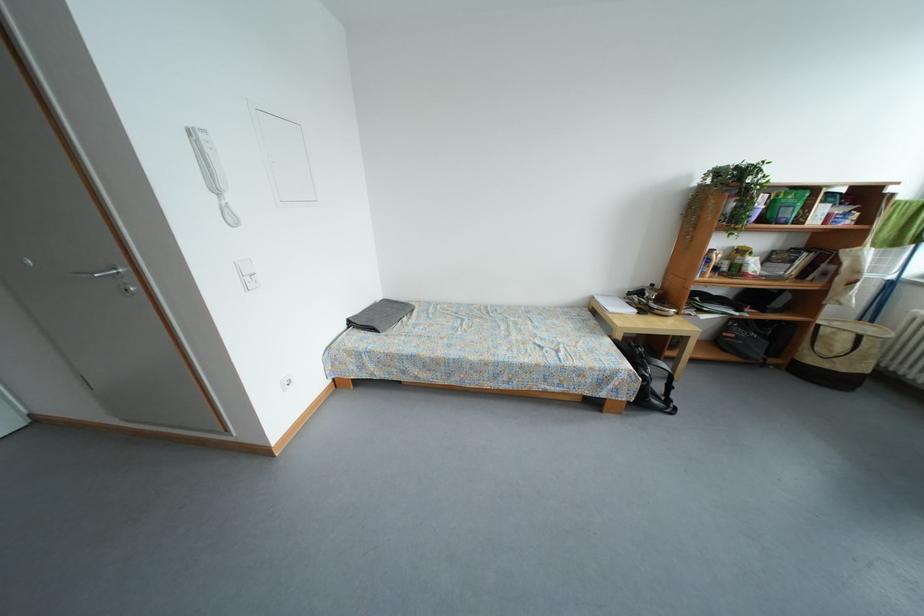
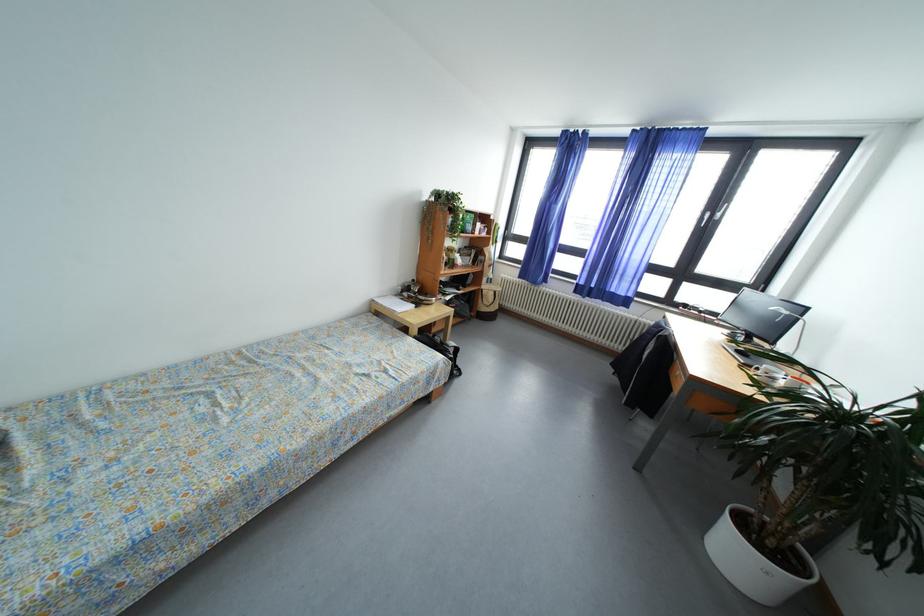
Question: Based on the continuous images, in which direction is the camera rotating? Reply with the corresponding letter.

Choices:
 (A) Left
 (B) Right
 (C) Up
 (D) Down

Answer: (B)